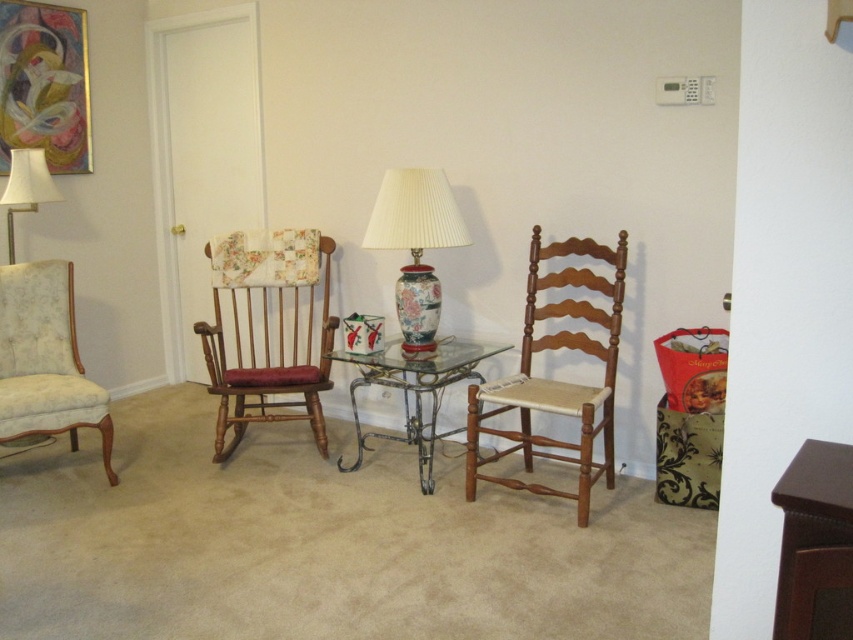
Question: Can you confirm if floral fabric armchair at left is positioned above white fabric lampshade at upper left?

Choices:
 (A) yes
 (B) no

Answer: (B)

Question: Does floral fabric armchair at left have a larger size compared to white fabric lampshade at upper left?

Choices:
 (A) no
 (B) yes

Answer: (B)

Question: Is floral fabric armchair at left positioned behind metallic wrought iron table at center?

Choices:
 (A) no
 (B) yes

Answer: (B)

Question: Estimate the real-world distances between objects in this image. Which object is farther from the floral fabric armchair at left?

Choices:
 (A) white fabric lampshade at upper left
 (B) porcelain floral lamp at center
 (C) wooden textured rocking chair at left

Answer: (B)

Question: Which object is the closest to the metallic wrought iron table at center?

Choices:
 (A) white fabric lampshade at upper left
 (B) wooden textured rocking chair at left
 (C) floral fabric armchair at left
 (D) porcelain floral lamp at center

Answer: (D)

Question: Which point is farther from the camera taking this photo?

Choices:
 (A) (39, 198)
 (B) (16, 436)

Answer: (A)